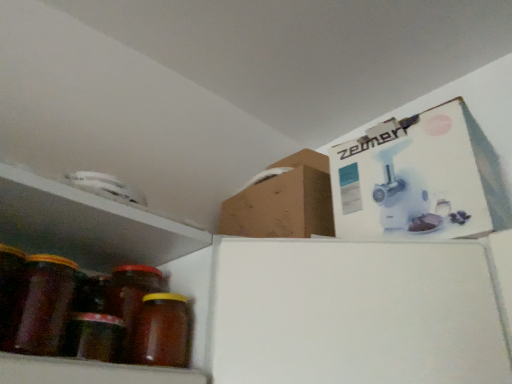
The image size is (512, 384). What do you see at coordinates (162, 331) in the screenshot? I see `brown matte jar at lower left, the first bottle from the right` at bounding box center [162, 331].

Locate an element on the screen. brown matte jar at left, marked as the 1th bottle in a left-to-right arrangement is located at coordinates (42, 306).

What is the approximate width of brown matte jar at left, which is counted as the second bottle, starting from the right?

brown matte jar at left, which is counted as the second bottle, starting from the right, is 9.22 centimeters in width.

You are a GUI agent. You are given a task and a screenshot of the screen. Output one action in this format:
    pyautogui.click(x=<x>, y=<y>)
    Task: Click on the translucent amber glass jar at lower left
    The image size is (512, 384).
    Given the screenshot: What is the action you would take?
    pyautogui.click(x=9, y=282)

Does point (48, 320) come in front of point (182, 311)?

Yes, it is in front of point (182, 311).

Is the position of brown matte jar at left, marked as the 1th bottle in a left-to-right arrangement, less distant than that of brown matte jar at lower left, the 2th bottle in the left-to-right sequence?

Yes, brown matte jar at left, marked as the 1th bottle in a left-to-right arrangement, is in front of brown matte jar at lower left, the 2th bottle in the left-to-right sequence.

Is brown matte jar at left, which is counted as the second bottle, starting from the right, completely or partially outside of brown matte jar at lower left, the 2th bottle in the left-to-right sequence?

Yes, brown matte jar at left, which is counted as the second bottle, starting from the right, is located beyond the bounds of brown matte jar at lower left, the 2th bottle in the left-to-right sequence.

Does brown matte jar at left, marked as the 1th bottle in a left-to-right arrangement, have a lesser width compared to brown matte jar at lower left, the 2th bottle in the left-to-right sequence?

Correct, the width of brown matte jar at left, marked as the 1th bottle in a left-to-right arrangement, is less than that of brown matte jar at lower left, the 2th bottle in the left-to-right sequence.

Measure the distance between brown matte jar at left, marked as the 1th bottle in a left-to-right arrangement, and translucent amber glass jar at lower left.

Result: brown matte jar at left, marked as the 1th bottle in a left-to-right arrangement, is 1.32 inches away from translucent amber glass jar at lower left.

From the picture: Is brown matte jar at left, marked as the 1th bottle in a left-to-right arrangement, looking in the opposite direction of translucent amber glass jar at lower left?

No, translucent amber glass jar at lower left is not at the back of brown matte jar at left, marked as the 1th bottle in a left-to-right arrangement.

Based on the photo, between brown matte jar at left, marked as the 1th bottle in a left-to-right arrangement, and translucent amber glass jar at lower left, which one is positioned in front?

translucent amber glass jar at lower left is closer to the camera.

Which is more to the left, brown matte jar at left, which is counted as the second bottle, starting from the right, or translucent amber glass jar at lower left?

From the viewer's perspective, translucent amber glass jar at lower left appears more on the left side.

Could you tell me if translucent amber glass jar at lower left is turned towards brown matte jar at left, which is counted as the second bottle, starting from the right?

No, translucent amber glass jar at lower left is not aimed at brown matte jar at left, which is counted as the second bottle, starting from the right.

At what (x,y) coordinates should I click in order to perform the action: click on glass jar below the brown matte jar at left, marked as the 1th bottle in a left-to-right arrangement (from a real-world perspective). Please return your answer as a coordinate pair (x, y). Looking at the image, I should click on (9, 282).

Which object is thinner, translucent amber glass jar at lower left or brown matte jar at left, marked as the 1th bottle in a left-to-right arrangement?

With smaller width is brown matte jar at left, marked as the 1th bottle in a left-to-right arrangement.

Considering the relative positions of translucent amber glass jar at lower left and brown matte jar at left, which is counted as the second bottle, starting from the right, in the image provided, is translucent amber glass jar at lower left to the left or to the right of brown matte jar at left, which is counted as the second bottle, starting from the right,?

From the image, it's evident that translucent amber glass jar at lower left is to the left of brown matte jar at left, which is counted as the second bottle, starting from the right.

Is translucent amber glass jar at lower left completely or partially outside of brown matte jar at lower left, the first bottle from the right?

Yes, translucent amber glass jar at lower left is located beyond the bounds of brown matte jar at lower left, the first bottle from the right.

From a real-world perspective, which object stands above the other?

brown matte jar at lower left, the 2th bottle in the left-to-right sequence, from a real-world perspective.

Considering the sizes of objects translucent amber glass jar at lower left and brown matte jar at lower left, the 2th bottle in the left-to-right sequence, in the image provided, who is shorter, translucent amber glass jar at lower left or brown matte jar at lower left, the 2th bottle in the left-to-right sequence,?

brown matte jar at lower left, the 2th bottle in the left-to-right sequence.

Which is behind, point (144, 342) or point (33, 294)?

Point (144, 342)

Is brown matte jar at lower left, the first bottle from the right, looking in the opposite direction of brown matte jar at left, which is counted as the second bottle, starting from the right?

No.

In terms of height, does brown matte jar at lower left, the 2th bottle in the left-to-right sequence, look taller or shorter compared to brown matte jar at left, marked as the 1th bottle in a left-to-right arrangement?

Clearly, brown matte jar at lower left, the 2th bottle in the left-to-right sequence, is shorter compared to brown matte jar at left, marked as the 1th bottle in a left-to-right arrangement.

Does brown matte jar at lower left, the 2th bottle in the left-to-right sequence, appear on the left side of brown matte jar at left, marked as the 1th bottle in a left-to-right arrangement?

No.

Considering the sizes of brown matte jar at lower left, the first bottle from the right, and translucent amber glass jar at lower left in the image, is brown matte jar at lower left, the first bottle from the right, wider or thinner than translucent amber glass jar at lower left?

brown matte jar at lower left, the first bottle from the right, is wider than translucent amber glass jar at lower left.

From a real-world perspective, between brown matte jar at lower left, the first bottle from the right, and translucent amber glass jar at lower left, who is vertically lower?

From a 3D spatial view, translucent amber glass jar at lower left is below.

Based on their sizes in the image, would you say brown matte jar at lower left, the 2th bottle in the left-to-right sequence, is bigger or smaller than translucent amber glass jar at lower left?

Clearly, brown matte jar at lower left, the 2th bottle in the left-to-right sequence, is smaller in size than translucent amber glass jar at lower left.

From the image's perspective, which one is positioned lower, brown matte jar at lower left, the 2th bottle in the left-to-right sequence, or translucent amber glass jar at lower left?

brown matte jar at lower left, the 2th bottle in the left-to-right sequence, from the image's perspective.

Identify the location of bottle in front of the brown matte jar at lower left, the 2th bottle in the left-to-right sequence. (42, 306).

This screenshot has height=384, width=512. In order to click on bottle that is the 2nd object above the translucent amber glass jar at lower left (from a real-world perspective) in this screenshot , I will do `click(42, 306)`.

When comparing their distances from brown matte jar at lower left, the 2th bottle in the left-to-right sequence, does translucent amber glass jar at lower left or brown matte jar at left, which is counted as the second bottle, starting from the right, seem further?

translucent amber glass jar at lower left is further to brown matte jar at lower left, the 2th bottle in the left-to-right sequence.

From the image, which object appears to be nearer to translucent amber glass jar at lower left, brown matte jar at lower left, the first bottle from the right, or brown matte jar at left, which is counted as the second bottle, starting from the right?

The object closer to translucent amber glass jar at lower left is brown matte jar at left, which is counted as the second bottle, starting from the right.

Looking at the image, which one is located closer to brown matte jar at left, marked as the 1th bottle in a left-to-right arrangement, translucent amber glass jar at lower left or brown matte jar at lower left, the 2th bottle in the left-to-right sequence?

translucent amber glass jar at lower left is positioned closer to the anchor brown matte jar at left, marked as the 1th bottle in a left-to-right arrangement.

Estimate the real-world distances between objects in this image. Which object is closer to brown matte jar at left, marked as the 1th bottle in a left-to-right arrangement, brown matte jar at lower left, the 2th bottle in the left-to-right sequence, or translucent amber glass jar at lower left?

Among the two, translucent amber glass jar at lower left is located nearer to brown matte jar at left, marked as the 1th bottle in a left-to-right arrangement.

When comparing their distances from brown matte jar at lower left, the 2th bottle in the left-to-right sequence, does brown matte jar at left, which is counted as the second bottle, starting from the right, or translucent amber glass jar at lower left seem closer?

Among the two, brown matte jar at left, which is counted as the second bottle, starting from the right, is located nearer to brown matte jar at lower left, the 2th bottle in the left-to-right sequence.

Looking at the image, which one is located further to translucent amber glass jar at lower left, brown matte jar at left, marked as the 1th bottle in a left-to-right arrangement, or brown matte jar at lower left, the 2th bottle in the left-to-right sequence?

brown matte jar at lower left, the 2th bottle in the left-to-right sequence.

This screenshot has width=512, height=384. Identify the location of bottle located between translucent amber glass jar at lower left and brown matte jar at lower left, the 2th bottle in the left-to-right sequence, in the left-right direction. (42, 306).